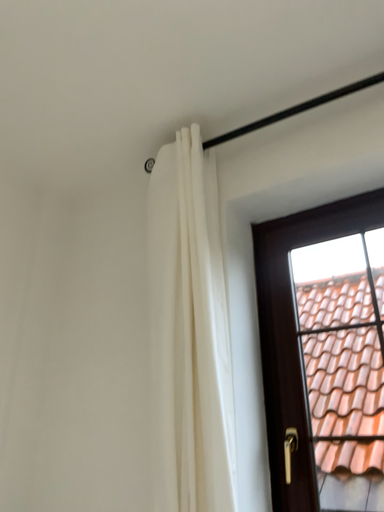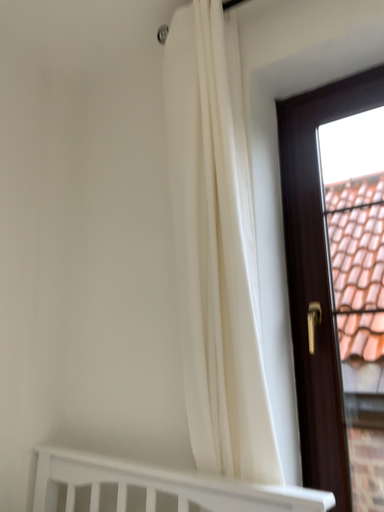
Question: How did the camera likely rotate when shooting the video?

Choices:
 (A) rotated upward
 (B) rotated downward

Answer: (B)